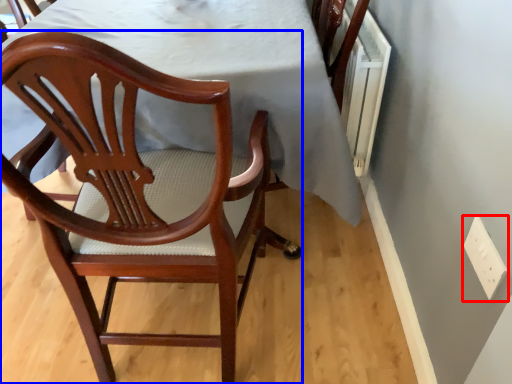
Question: Which of the following is the closest to the observer, electric outlet (highlighted by a red box) or chair (highlighted by a blue box)?

Choices:
 (A) electric outlet
 (B) chair

Answer: (B)